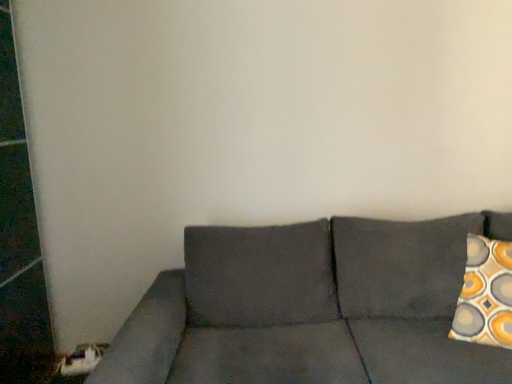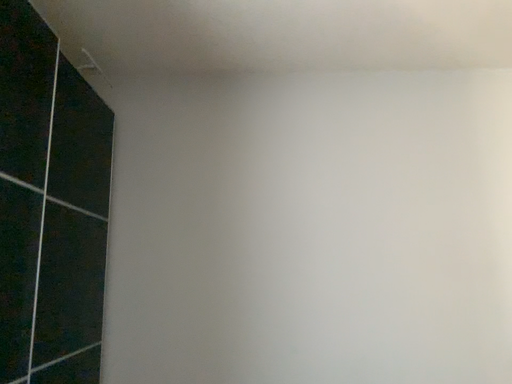
Question: How did the camera likely rotate when shooting the video?

Choices:
 (A) rotated downward
 (B) rotated upward

Answer: (B)